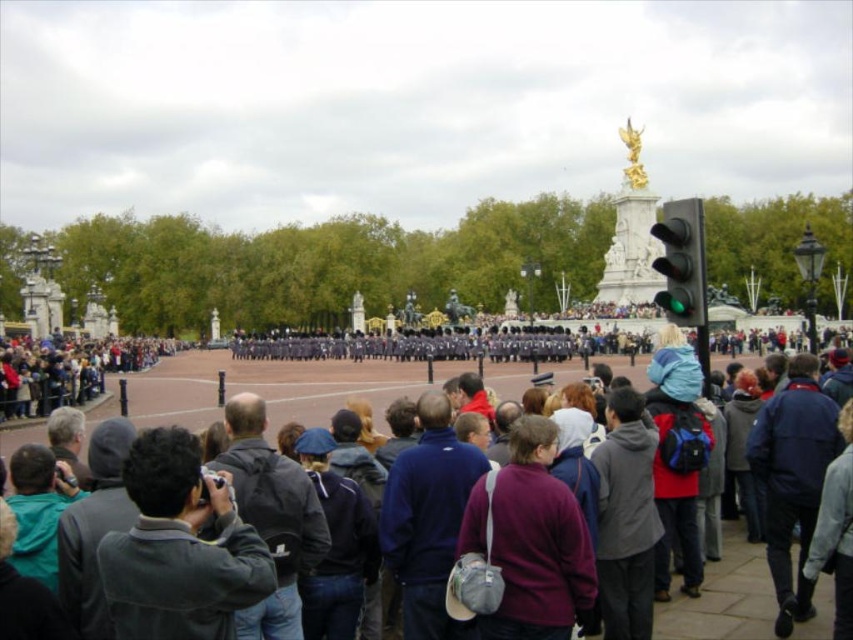
Question: Can you confirm if dark gray jacket at center is wider than dark gray jacket at left?

Choices:
 (A) no
 (B) yes

Answer: (B)

Question: Is dark gray jacket at center positioned at the back of dark gray jacket at left?

Choices:
 (A) no
 (B) yes

Answer: (A)

Question: Which object appears farthest from the camera in this image?

Choices:
 (A) dark gray jacket at left
 (B) dark gray jacket at center

Answer: (A)

Question: Which of the following is the farthest from the observer?

Choices:
 (A) dark gray jacket at center
 (B) dark gray jacket at left
 (C) green glass traffic light at center

Answer: (B)

Question: Can you confirm if dark gray jacket at center is wider than dark gray jacket at left?

Choices:
 (A) yes
 (B) no

Answer: (A)

Question: Among these points, which one is farthest from the camera?

Choices:
 (A) (686, 204)
 (B) (250, 371)

Answer: (B)